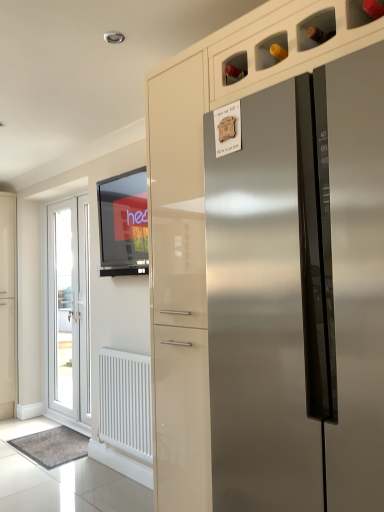
Question: From a real-world perspective, is matte black tv at upper left on stainless steel refrigerator at center?

Choices:
 (A) no
 (B) yes

Answer: (B)

Question: Is matte black tv at upper left behind stainless steel refrigerator at center?

Choices:
 (A) no
 (B) yes

Answer: (B)

Question: Is matte black tv at upper left next to stainless steel refrigerator at center?

Choices:
 (A) no
 (B) yes

Answer: (A)

Question: From a real-world perspective, is matte black tv at upper left under stainless steel refrigerator at center?

Choices:
 (A) no
 (B) yes

Answer: (A)

Question: Is matte black tv at upper left shorter than stainless steel refrigerator at center?

Choices:
 (A) yes
 (B) no

Answer: (A)

Question: Does matte black tv at upper left have a larger size compared to stainless steel refrigerator at center?

Choices:
 (A) no
 (B) yes

Answer: (A)

Question: Does white matte radiator at lower left appear on the right side of white glossy door at left?

Choices:
 (A) yes
 (B) no

Answer: (A)

Question: Is white matte radiator at lower left thinner than white glossy door at left?

Choices:
 (A) yes
 (B) no

Answer: (A)

Question: Does white matte radiator at lower left appear on the left side of white glossy door at left?

Choices:
 (A) yes
 (B) no

Answer: (B)

Question: Is white matte radiator at lower left oriented towards white glossy door at left?

Choices:
 (A) no
 (B) yes

Answer: (A)

Question: Is white matte radiator at lower left positioned behind white glossy door at left?

Choices:
 (A) no
 (B) yes

Answer: (A)

Question: From a real-world perspective, is white matte radiator at lower left under white glossy door at left?

Choices:
 (A) yes
 (B) no

Answer: (A)

Question: Considering the relative positions of stainless steel refrigerator at center and white glossy door at left in the image provided, is stainless steel refrigerator at center to the left of white glossy door at left from the viewer's perspective?

Choices:
 (A) yes
 (B) no

Answer: (B)